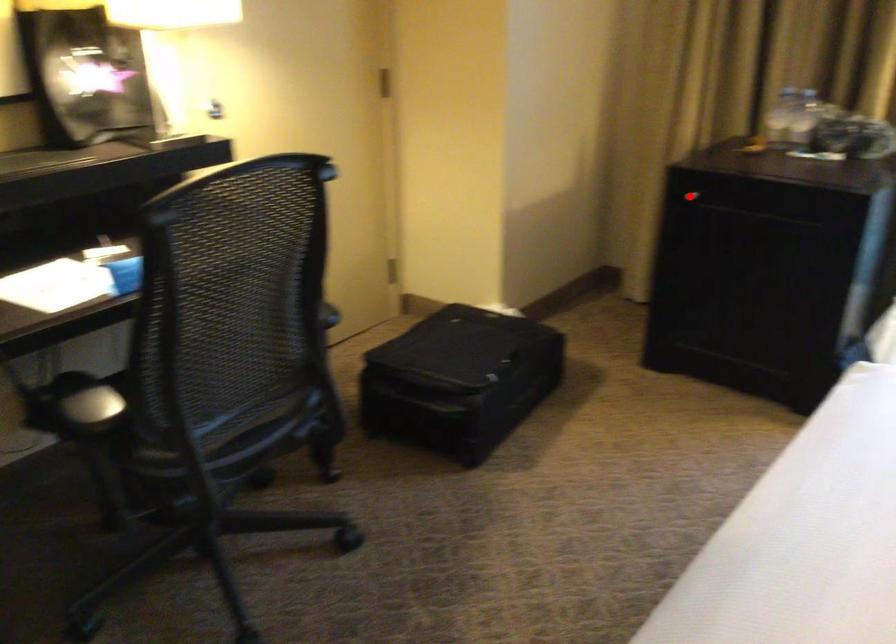
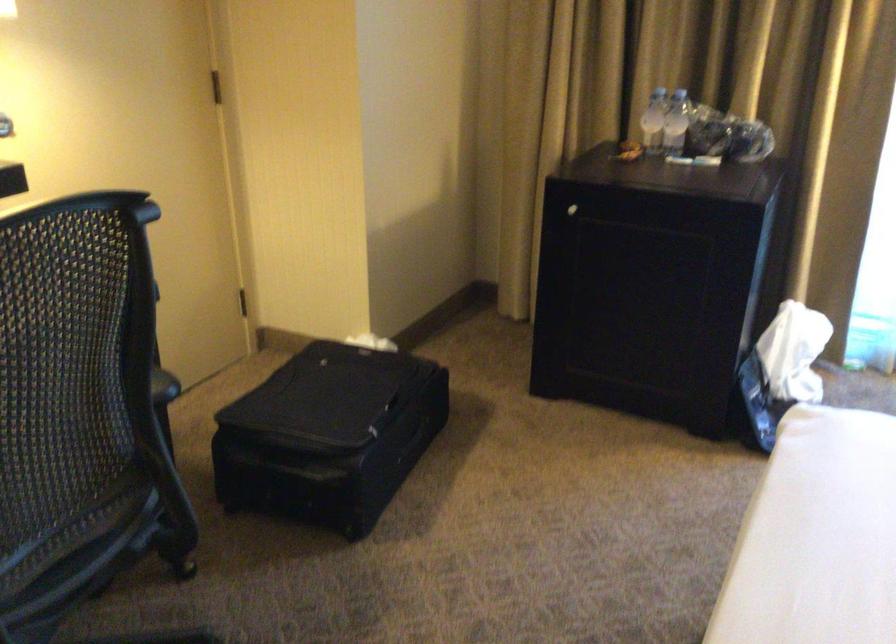
Question: A red point is marked in image1. In image2, is the corresponding 3D point closer to the camera or farther? Reply with the corresponding letter.

Choices:
 (A) The corresponding 3D point is closer.
 (B) The corresponding 3D point is farther.

Answer: (A)